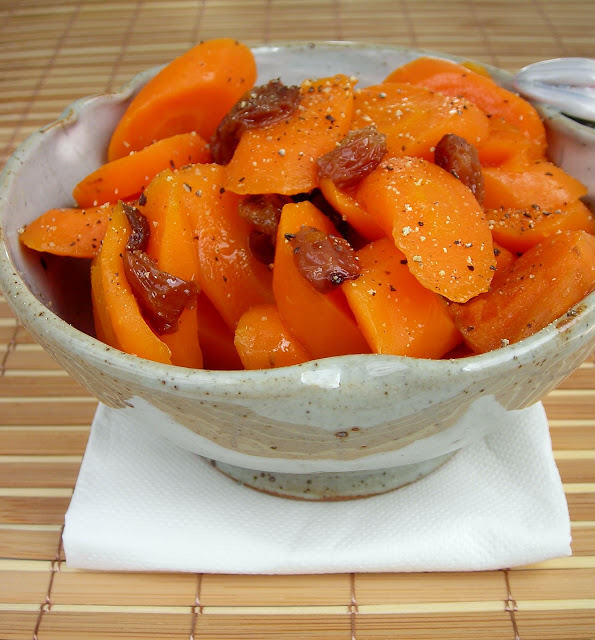
Locate an element on the screen. base of bowl is located at coordinates (335, 486).